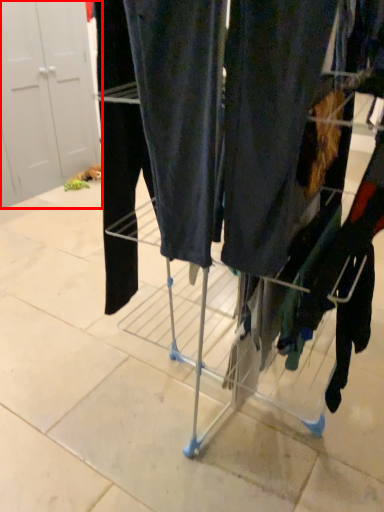
Question: In this image, where is door (annotated by the red box) located relative to trolley?

Choices:
 (A) right
 (B) left

Answer: (B)